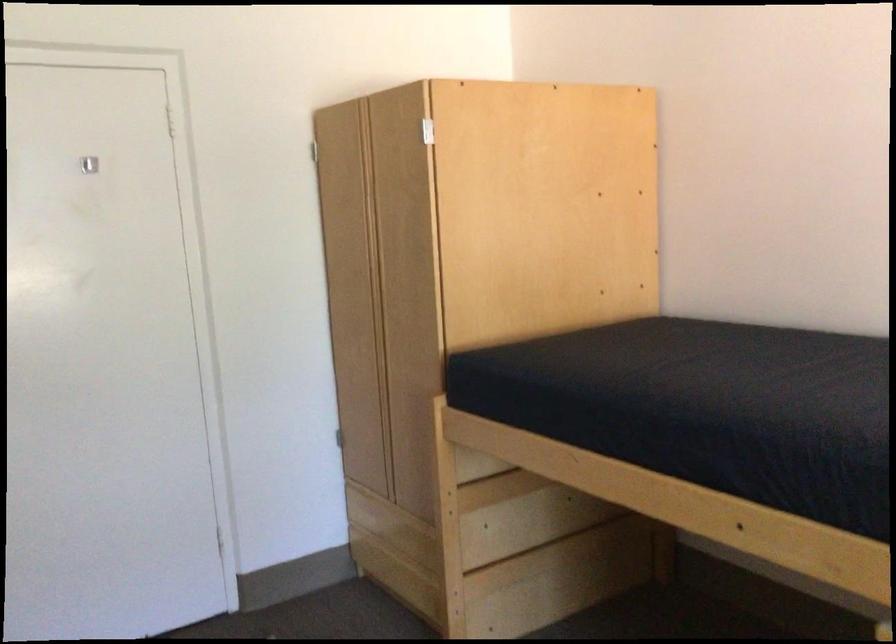
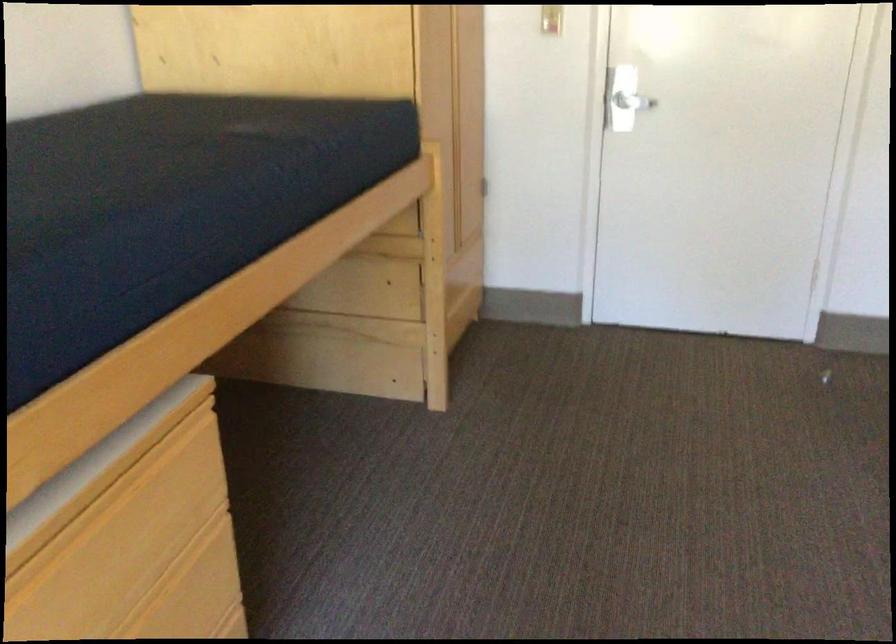
The images are taken continuously from a first-person perspective. In which direction is your viewpoint rotating?

The camera rotated toward left-down.